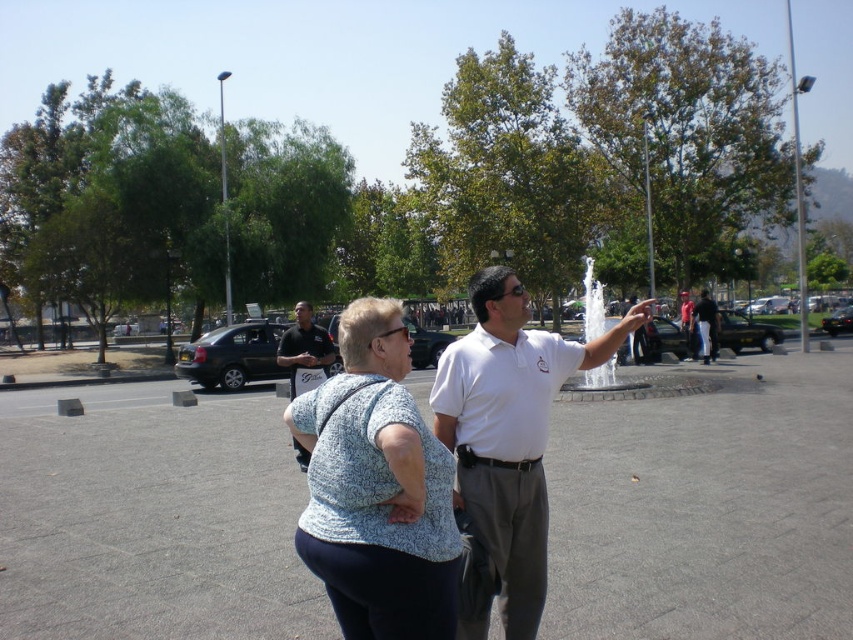
You are standing in the public square and want to take a photo that includes both the point at (489, 448) and the point at (689, 340). Which point should you focus on to ensure both are in sharp focus?

You should focus on the point at (689, 340) because it is farther from the camera than the point at (489, 448). By focusing on the farther point, the closer point will also be within the depth of field, ensuring both are in sharp focus.

You are standing in the park and see two points marked in the image. The first point is at coordinate point (346, 332) and the second is at point (691, 326). Which point is closer to you?

Point (346, 332) is in front of point (691, 326), so it is closer to you.

You are a photographer trying to capture a candid shot of two people in the park. The subjects are the dark gray uniform at center and the white shirt at center. If your camera has a maximum focus range of 15 meters, will you be able to get a clear photo of both subjects simultaneously?

The distance between the dark gray uniform at center and the white shirt at center is 17.13 meters, which exceeds the camera maximum focus range of 15 meters. Therefore, you cannot get a clear photo of both subjects simultaneously.